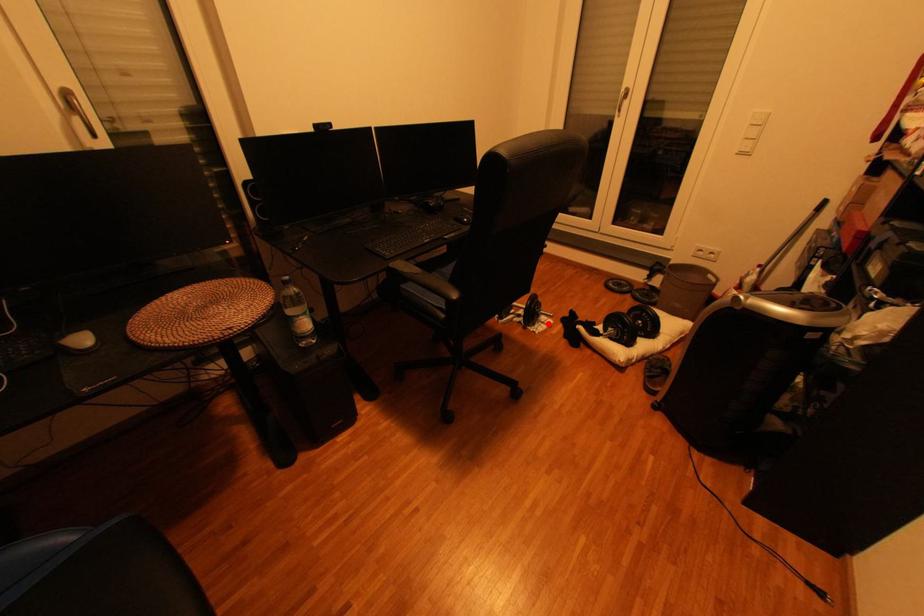
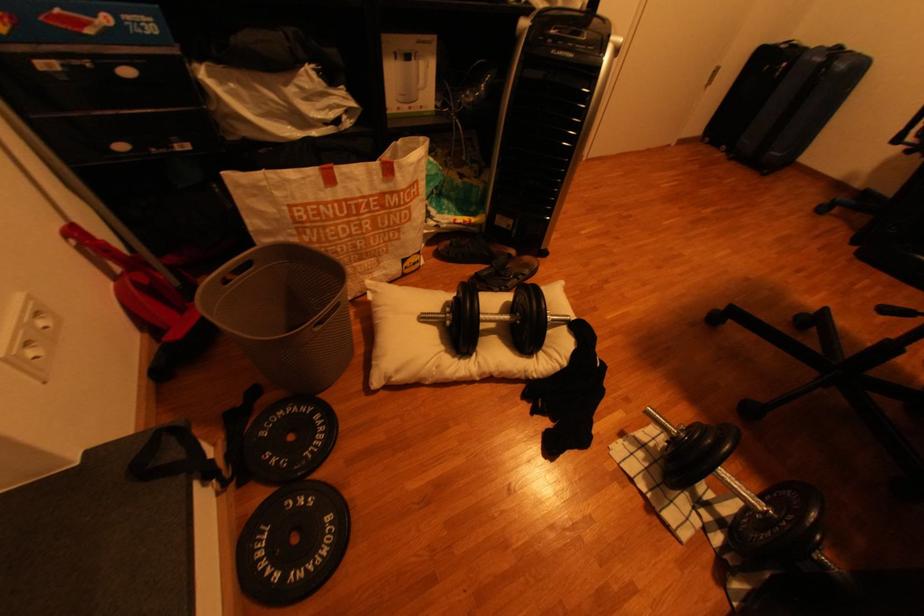
Question: I am providing you with two images of the same scene from different viewpoints. Image1 has a red point marked. In image2, the corresponding 3D location appears at what relative position? Reply with the corresponding letter.

Choices:
 (A) Closer
 (B) Farther

Answer: (B)